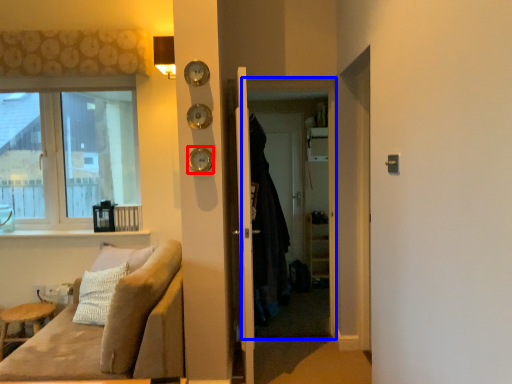
Question: Which object is closer to the camera taking this photo, clock (highlighted by a red box) or screen door (highlighted by a blue box)?

Choices:
 (A) clock
 (B) screen door

Answer: (A)